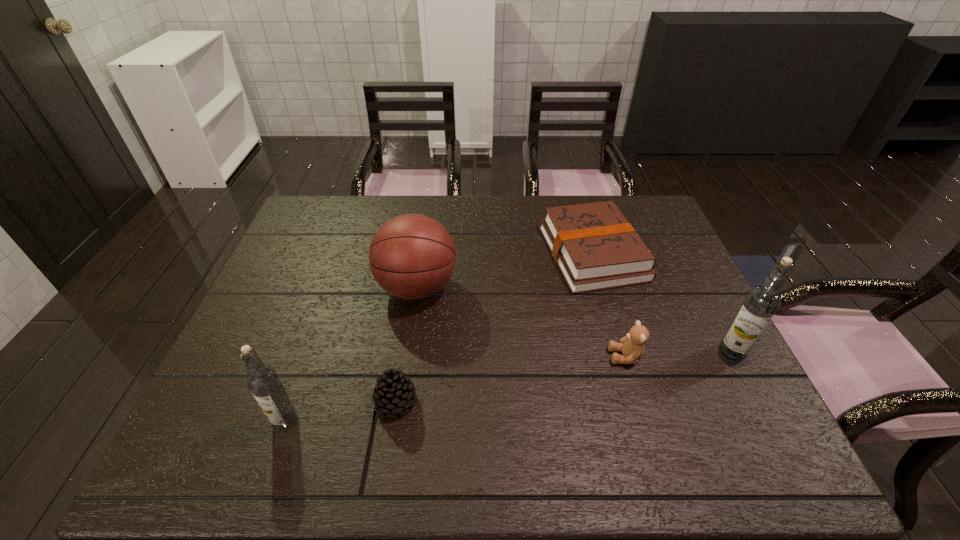
Where is `free spot that satisfies the following two spatial constraints: 1. at the narrow end of the pinecone; 2. on the label of the leftmost object`? free spot that satisfies the following two spatial constraints: 1. at the narrow end of the pinecone; 2. on the label of the leftmost object is located at coordinates (393, 421).

Where is `free region that satisfies the following two spatial constraints: 1. at the narrow end of the pinecone; 2. on the label of the leftmost object`? free region that satisfies the following two spatial constraints: 1. at the narrow end of the pinecone; 2. on the label of the leftmost object is located at coordinates (393, 421).

Identify the location of blank area in the image that satisfies the following two spatial constraints: 1. on the face of the teddy bear; 2. at the narrow end of the pinecone. The width and height of the screenshot is (960, 540). (638, 401).